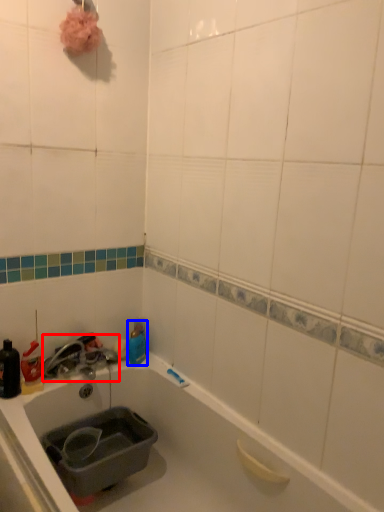
Question: Which point is further to the camera, faucet (highlighted by a red box) or bottle (highlighted by a blue box)?

Choices:
 (A) faucet
 (B) bottle

Answer: (B)